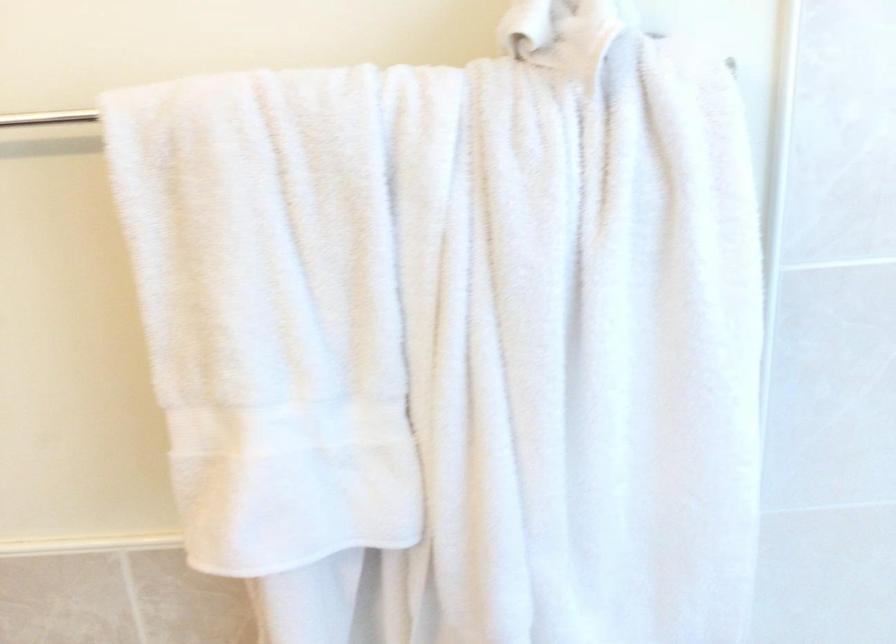
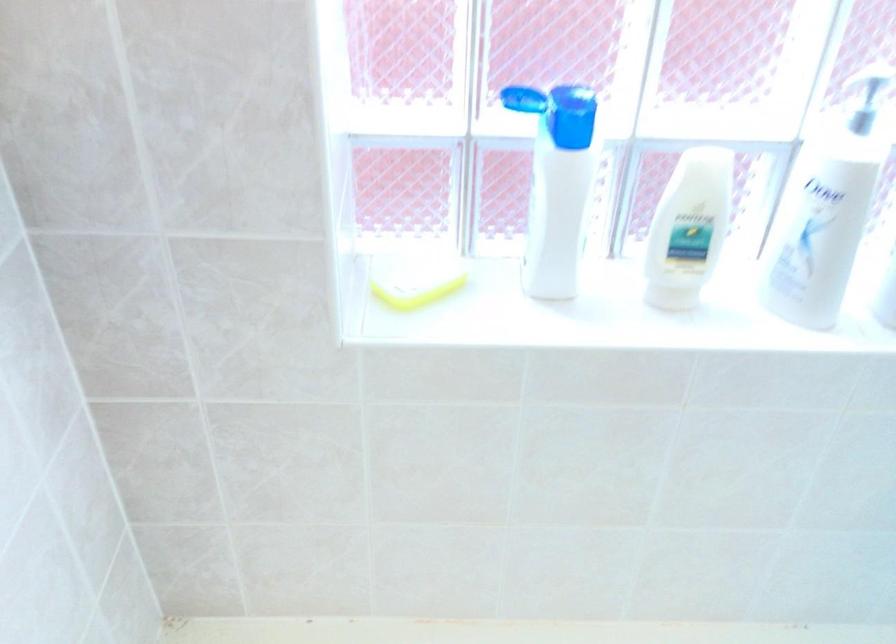
The first image is from the beginning of the video and the second image is from the end. How did the camera likely rotate when shooting the video?

The rotation direction of the camera is right-down.